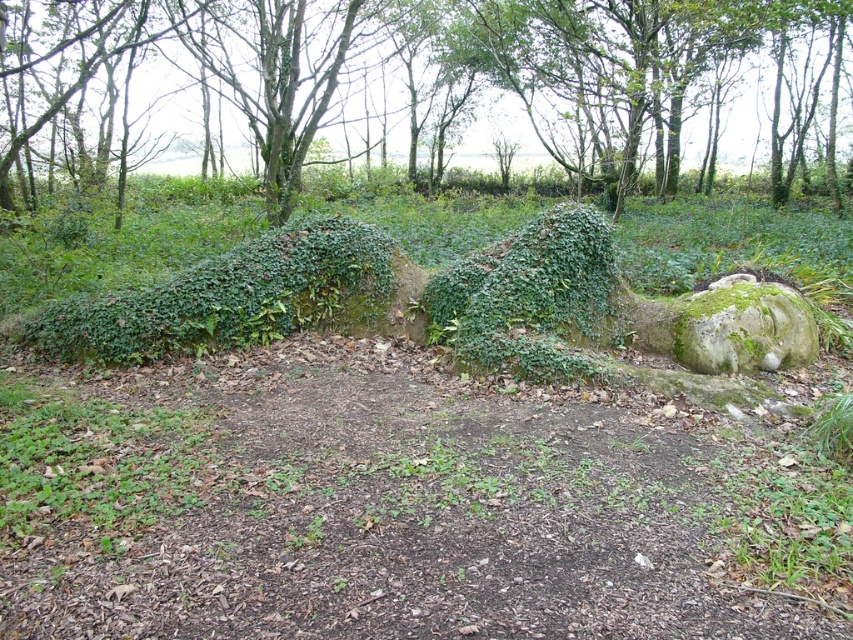
You are a hiker trying to navigate through the forest. You see the green mossy rock at center and the green mossy hedge at center. Which one is located to the right of the other?

The green mossy rock at center is positioned on the right side of green mossy hedge at center.

You are a hiker who wants to place a 10 meter long tent between the green mossy rock at center and the green mossy hedge at center. Can you fit the tent between them?

The distance between the green mossy rock at center and the green mossy hedge at center is 11.64 meters, so the 10 meter long tent can fit between them with 1.64 meters of space remaining.

You are a gardener planning to place a 1.2 meter wide decorative statue between the green mossy rock at center and the green mossy hedge at center. Based on their widths, which object should the statue be placed next to to ensure it fits without overlapping?

The green mossy rock at center is wider than the green mossy hedge at center. Therefore, placing the 1.2 meter wide decorative statue next to the green mossy rock at center would provide sufficient space as it is wider, allowing the statue to fit without overlapping.